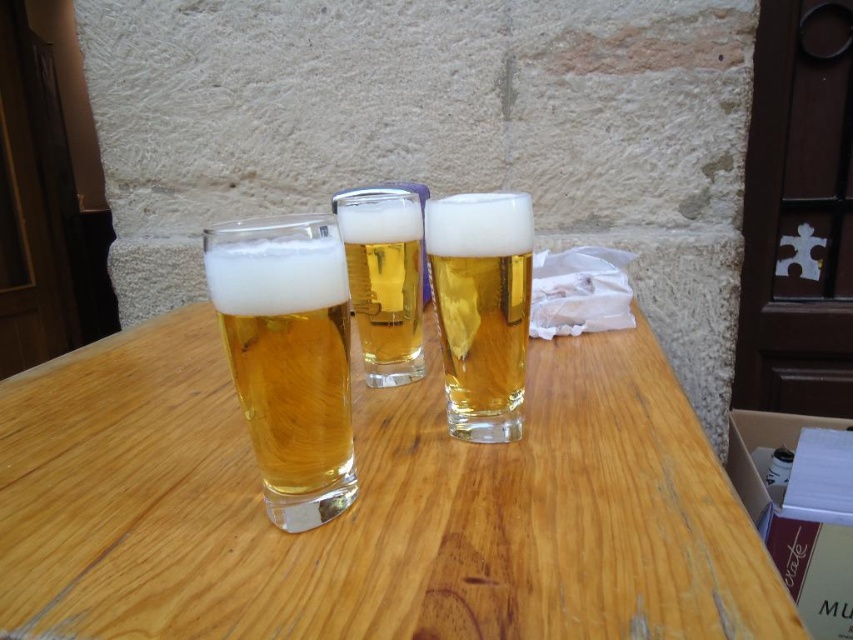
Which is below, wooden table at center or translucent glass at center?

wooden table at center

Who is higher up, wooden table at center or translucent glass at center?

translucent glass at center

You are a GUI agent. You are given a task and a screenshot of the screen. Output one action in this format:
    pyautogui.click(x=<x>, y=<y>)
    Task: Click on the wooden table at center
    
    Given the screenshot: What is the action you would take?
    pyautogui.click(x=372, y=508)

Who is positioned more to the left, wooden table at center or golden glass at center?

wooden table at center

Looking at this image, does wooden table at center have a smaller size compared to golden glass at center?

No, wooden table at center is not smaller than golden glass at center.

Who is more forward, (68, 582) or (403, 289)?

Point (68, 582) is in front.

The height and width of the screenshot is (640, 853). In order to click on wooden table at center in this screenshot , I will do `click(372, 508)`.

Is point (328, 300) positioned in front of point (405, 202)?

Yes, it is.

Locate an element on the screen. clear glass beer at left is located at coordinates (288, 356).